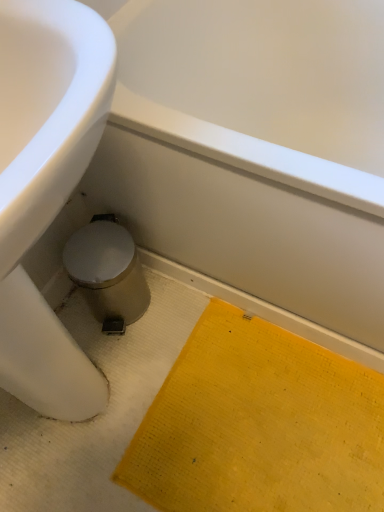
Identify the location of yellow textured mat at lower right. Image resolution: width=384 pixels, height=512 pixels. (259, 425).

Image resolution: width=384 pixels, height=512 pixels. Describe the element at coordinates (259, 425) in the screenshot. I see `yellow textured mat at lower right` at that location.

Locate an element on the screen. The image size is (384, 512). yellow textured mat at lower right is located at coordinates [x=259, y=425].